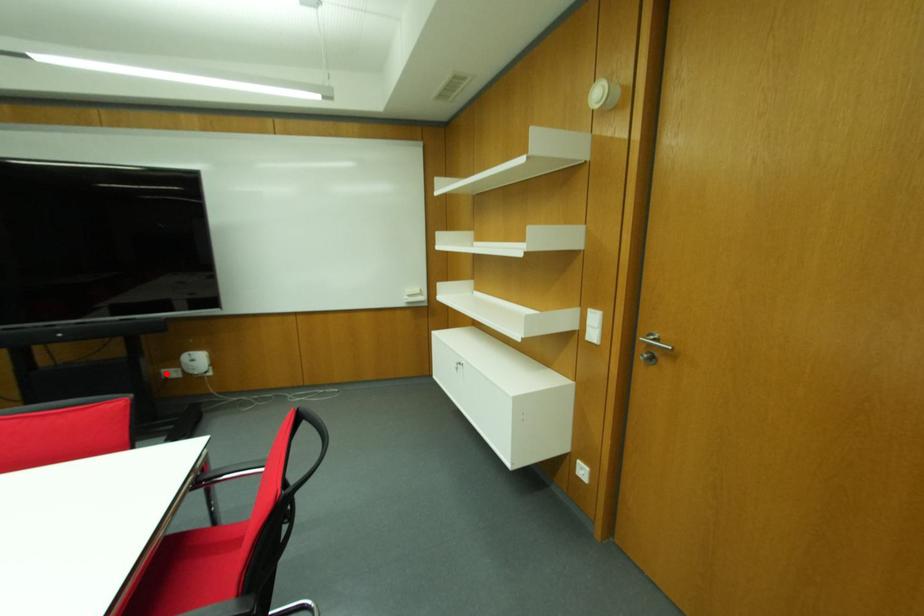
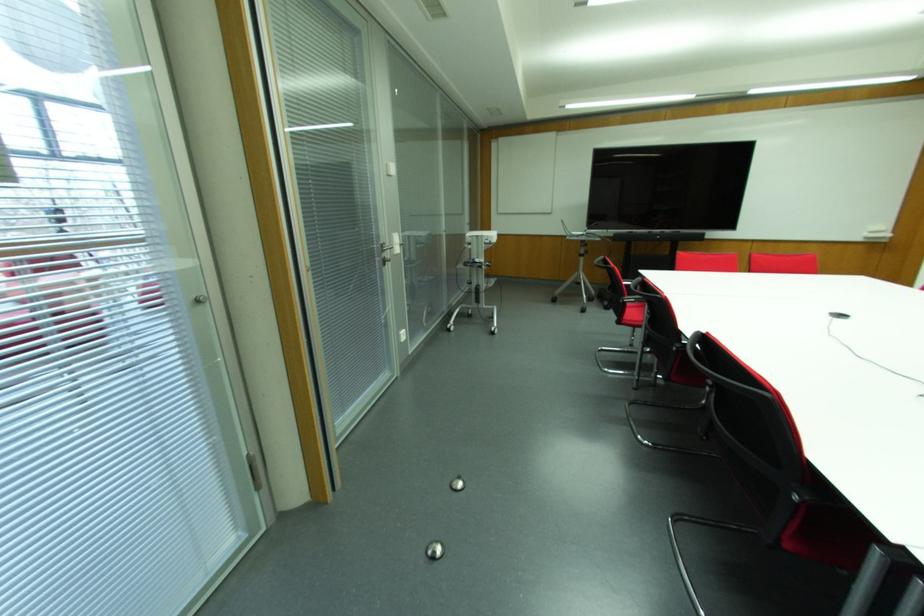
Question: I am providing you with two images of the same scene from different viewpoints. A red point is marked on the first image. Is the red point's position out of view in image 2?

Choices:
 (A) Yes
 (B) No

Answer: (A)